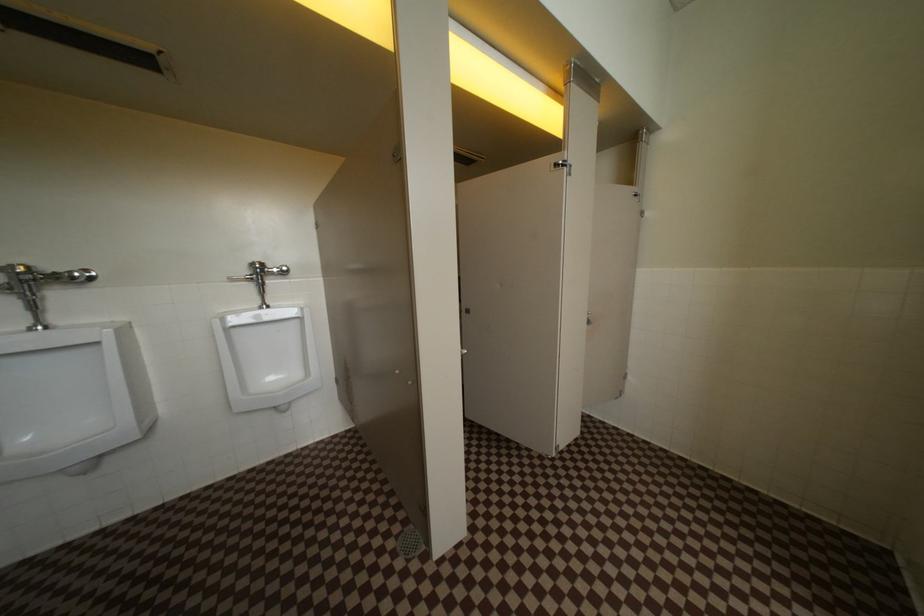
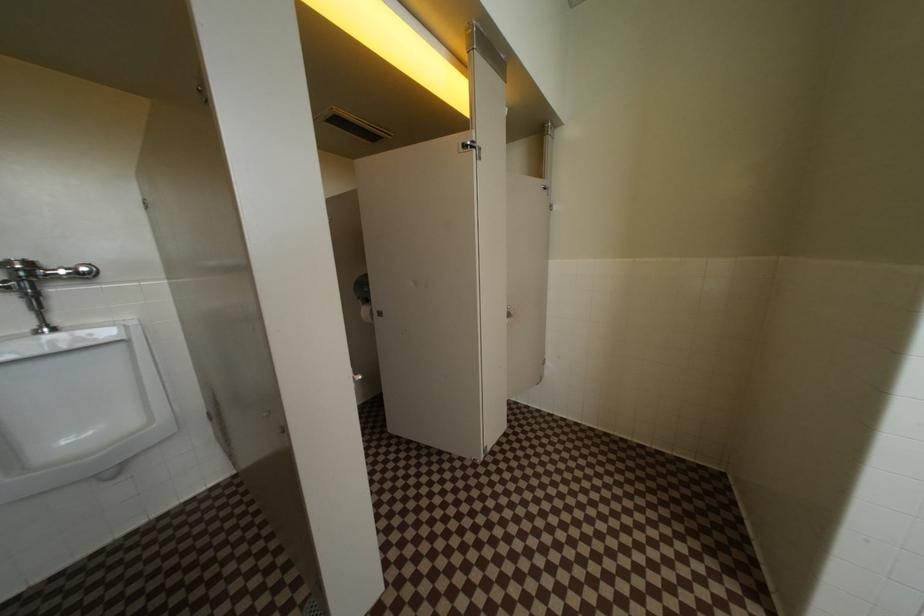
Question: The images are taken continuously from a first-person perspective. In which direction is your viewpoint rotating?

Choices:
 (A) Left
 (B) Right
 (C) Up
 (D) Down

Answer: (B)